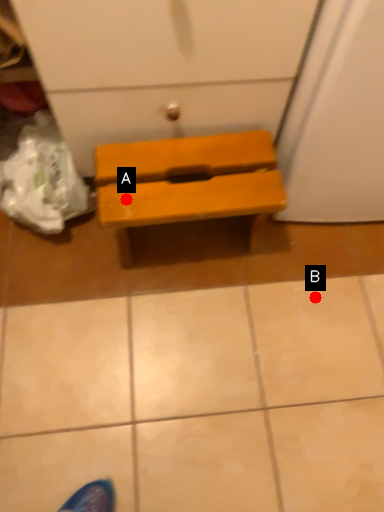
Question: Two points are circled on the image, labeled by A and B beside each circle. Which point is farther from the camera taking this photo?

Choices:
 (A) A is further
 (B) B is further

Answer: (B)